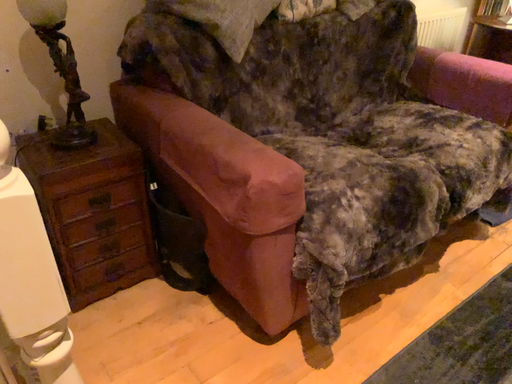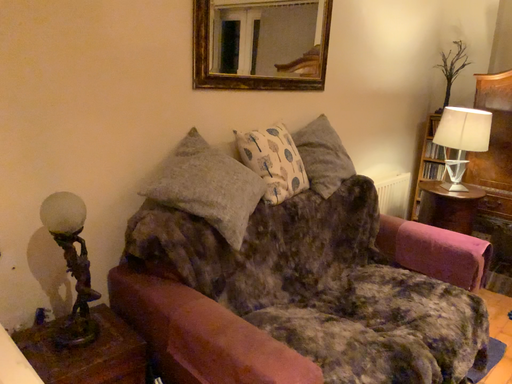
Question: How did the camera likely rotate when shooting the video?

Choices:
 (A) rotated upward
 (B) rotated downward

Answer: (A)